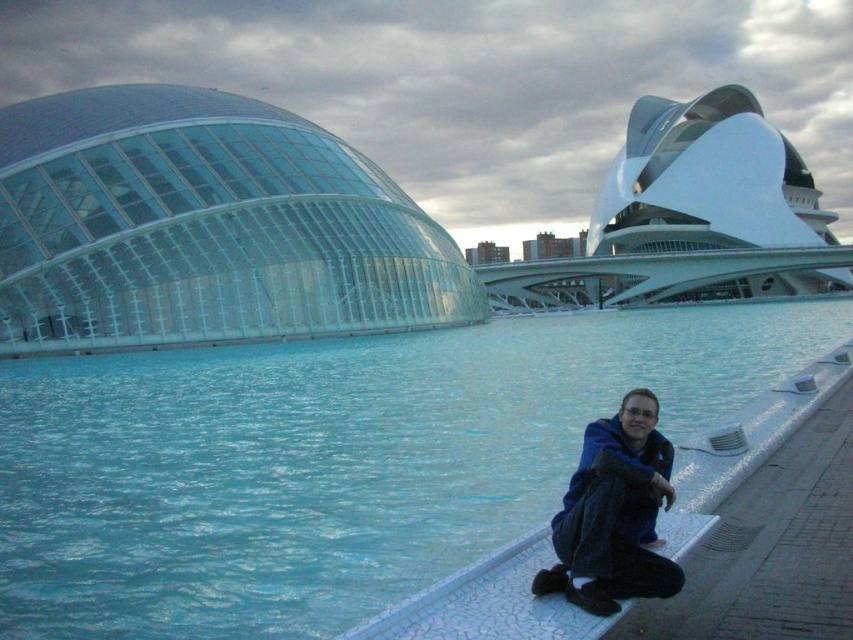
Question: Is blue glass water at center below blue fleece jacket at lower right?

Choices:
 (A) yes
 (B) no

Answer: (B)

Question: Among these points, which one is nearest to the camera?

Choices:
 (A) (152, 572)
 (B) (595, 444)

Answer: (B)

Question: Is blue glass water at center bigger than blue fleece jacket at lower right?

Choices:
 (A) yes
 (B) no

Answer: (A)

Question: Which point is farther from the camera taking this photo?

Choices:
 (A) (653, 538)
 (B) (335, 432)

Answer: (B)

Question: Can you confirm if blue glass water at center is positioned above blue fleece jacket at lower right?

Choices:
 (A) yes
 (B) no

Answer: (A)